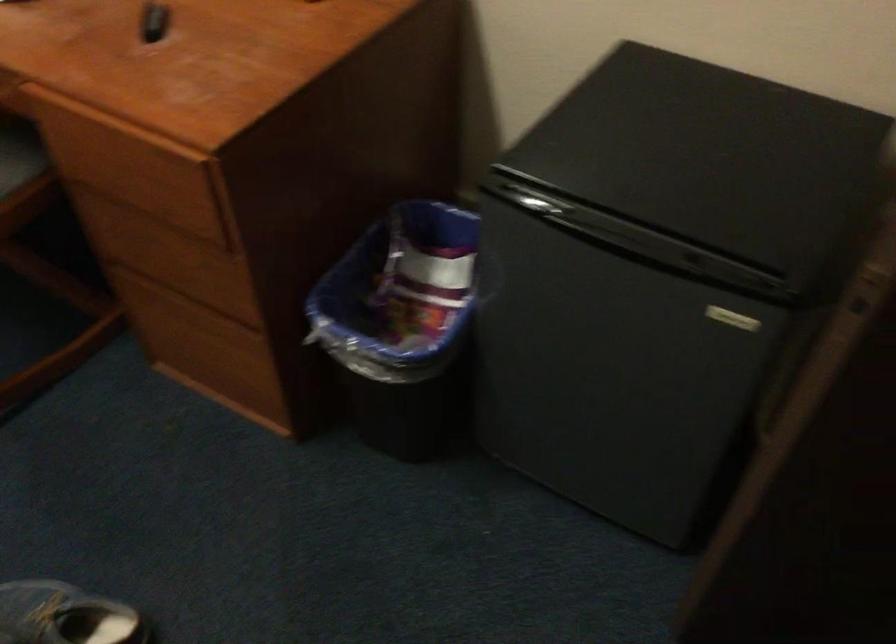
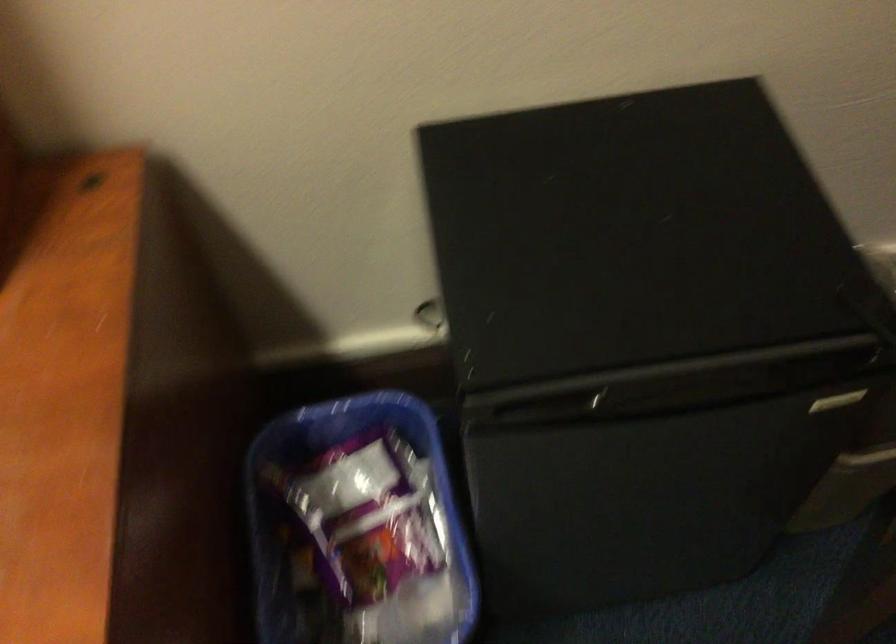
Question: The first image is from the beginning of the video and the second image is from the end. How did the camera likely rotate when shooting the video?

Choices:
 (A) Left
 (B) Right
 (C) Up
 (D) Down

Answer: (B)